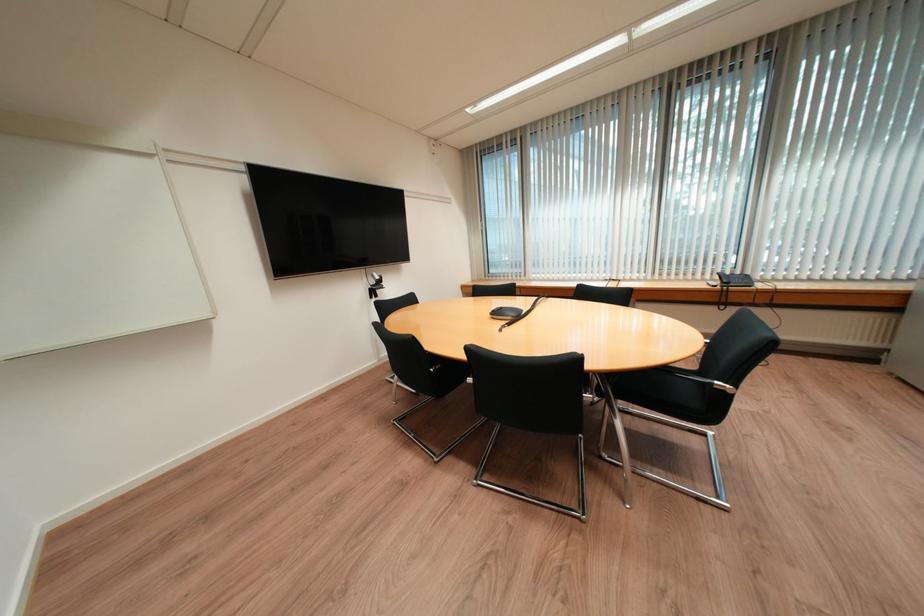
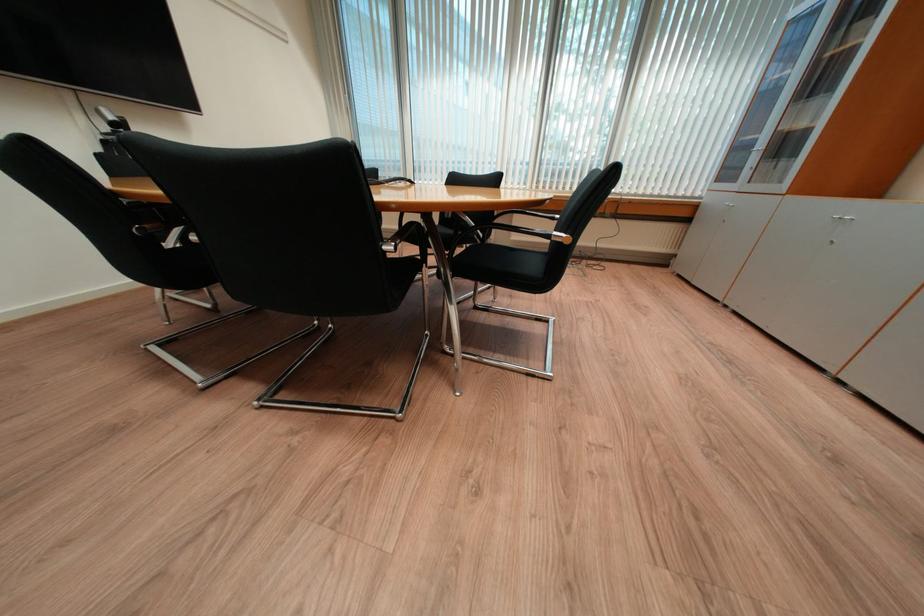
The images are taken continuously from a first-person perspective. In which direction are you moving?

The cameraman walked toward right, forward.